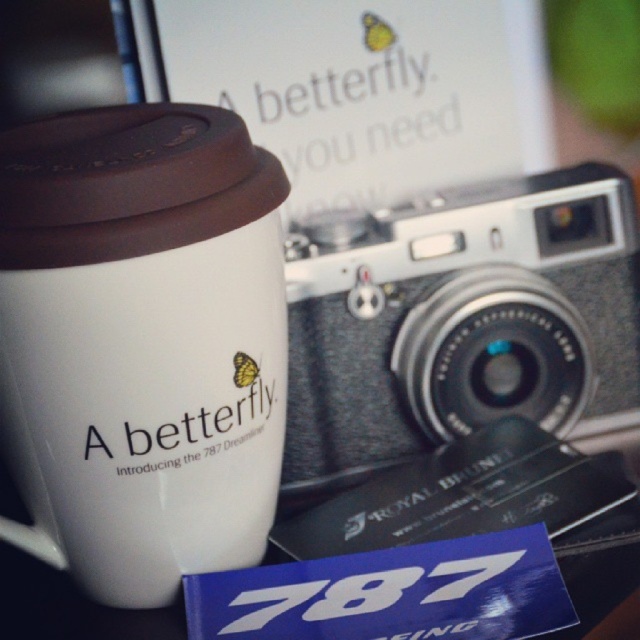
Which is more to the left, white matte mug at left or silver textured film camera at center?

white matte mug at left is more to the left.

Is white matte mug at left above silver textured film camera at center?

No.

Does point (266, 323) lie behind point (410, 227)?

No, (266, 323) is closer to viewer.

This screenshot has height=640, width=640. In order to click on white matte mug at left in this screenshot , I will do `click(141, 342)`.